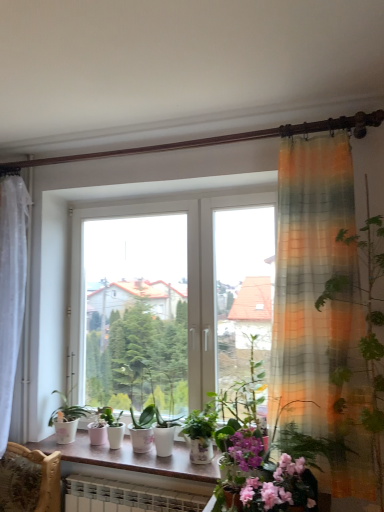
What are the coordinates of `space that is in front of green matte plant at center` in the screenshot? It's located at (123, 449).